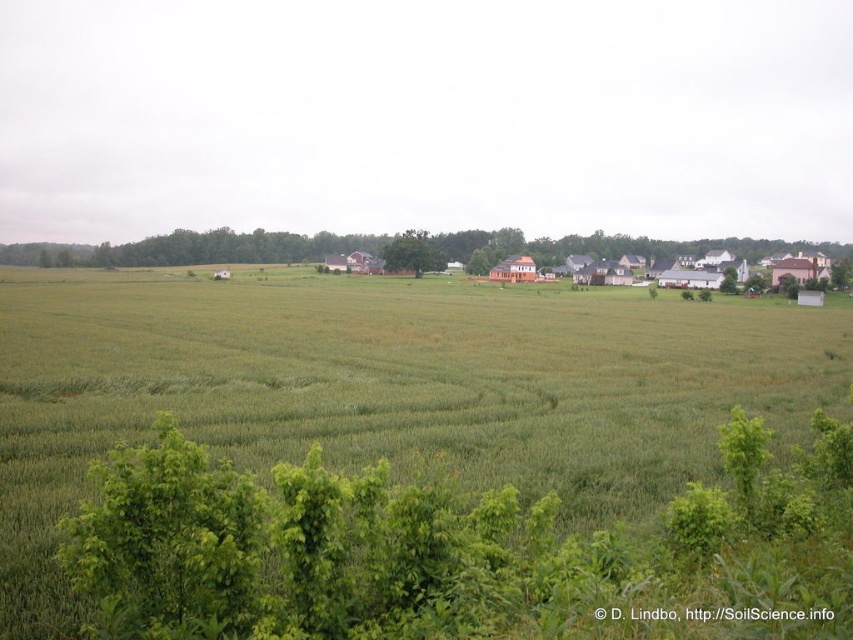
Is point (146, 244) in front of point (434, 269)?

No, (146, 244) is further to viewer.

Who is taller, green leafy tree at upper center or green leafy tree at center?

green leafy tree at upper center is taller.

At what (x,y) coordinates should I click in order to perform the action: click on green leafy tree at upper center. Please return your answer as a coordinate pair (x, y). The height and width of the screenshot is (640, 853). Looking at the image, I should click on (199, 248).

Where is `green leafy tree at upper center`? The width and height of the screenshot is (853, 640). green leafy tree at upper center is located at coordinates (199, 248).

Is point (86, 396) positioned behind point (438, 243)?

No, it is in front of (438, 243).

Can you confirm if green grassy field at center is bigger than green leafy tree at upper center?

No.

This screenshot has width=853, height=640. What do you see at coordinates (383, 368) in the screenshot?
I see `green grassy field at center` at bounding box center [383, 368].

Locate an element on the screen. This screenshot has width=853, height=640. green grassy field at center is located at coordinates (383, 368).

Can you confirm if green grassy field at center is wider than green leafy tree at center?

Indeed, green grassy field at center has a greater width compared to green leafy tree at center.

Who is more forward, (550,360) or (440,260)?

Point (550,360) is in front.

Identify the location of green grassy field at center. The width and height of the screenshot is (853, 640). (383, 368).